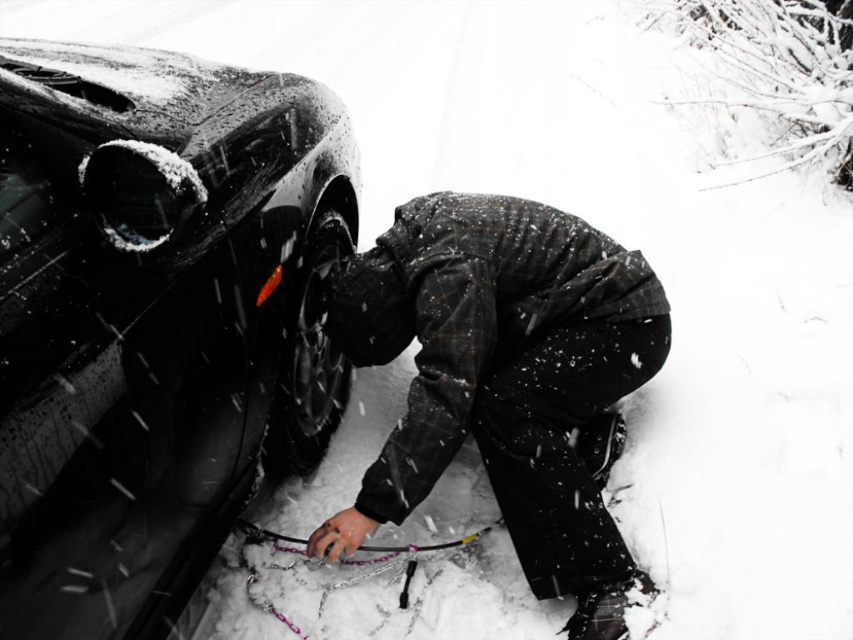
Between dark woolen jacket at lower center and black rubber tire at center, which one is positioned higher?

black rubber tire at center is higher up.

Who is more distant from viewer, (532, 244) or (308, 280)?

Point (308, 280)

What are the coordinates of `dark woolen jacket at lower center` in the screenshot? It's located at (505, 380).

Locate an element on the screen. The width and height of the screenshot is (853, 640). dark woolen jacket at lower center is located at coordinates (505, 380).

Can you confirm if glossy black car at left is taller than black rubber tire at center?

Yes.

Is glossy black car at left bigger than black rubber tire at center?

Indeed, glossy black car at left has a larger size compared to black rubber tire at center.

The height and width of the screenshot is (640, 853). I want to click on glossy black car at left, so click(x=154, y=320).

The width and height of the screenshot is (853, 640). What are the coordinates of `glossy black car at left` in the screenshot? It's located at (154, 320).

Does glossy black car at left have a lesser width compared to dark woolen jacket at lower center?

No, glossy black car at left is not thinner than dark woolen jacket at lower center.

At what (x,y) coordinates should I click in order to perform the action: click on glossy black car at left. Please return your answer as a coordinate pair (x, y). Looking at the image, I should click on (154, 320).